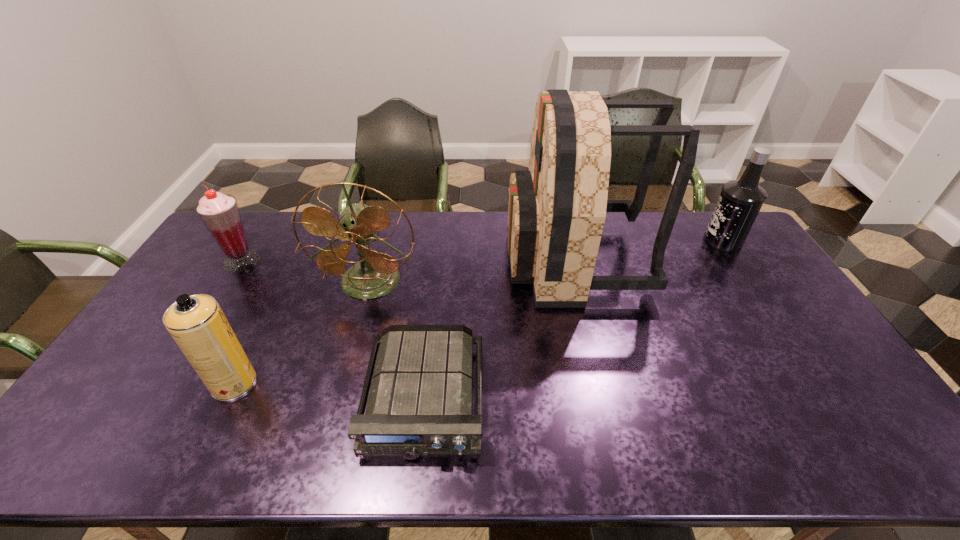
Identify the location of vacant space located in front of the fan, directing air flow. The image size is (960, 540). coord(337,401).

This screenshot has height=540, width=960. Identify the location of vacant space located on the front label of the rightmost object. (595, 240).

Find the location of a particular element. Image resolution: width=960 pixels, height=540 pixels. free point located 0.390m on the front label of the rightmost object is located at coordinates (598, 240).

What are the coordinates of `vacant space located 0.180m on the front label of the rightmost object` in the screenshot? It's located at (655, 240).

Locate an element on the screen. The height and width of the screenshot is (540, 960). vacant region located 0.310m on the right of the second object from left to right is located at coordinates (373, 383).

Locate an element on the screen. free space located on the back of the smoothie is located at coordinates (265, 225).

At what (x,y) coordinates should I click in order to perform the action: click on backpack that is at the far edge. Please return your answer as a coordinate pair (x, y). The height and width of the screenshot is (540, 960). Looking at the image, I should click on (557, 209).

In order to click on liquor at the far edge in this screenshot , I will do `click(740, 201)`.

Identify the location of object located at the near edge. The image size is (960, 540). (420, 402).

Locate an element on the screen. Image resolution: width=960 pixels, height=540 pixels. object that is at the left edge is located at coordinates (219, 212).